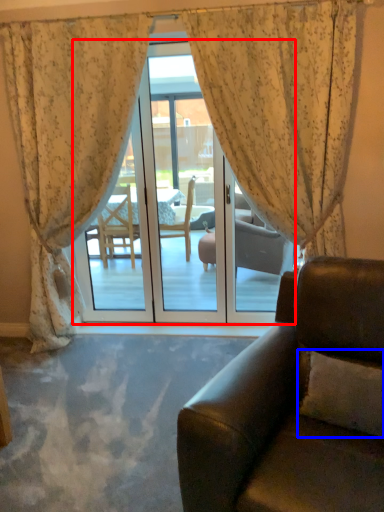
Question: Among these objects, which one is nearest to the camera, door (highlighted by a red box) or pillow (highlighted by a blue box)?

Choices:
 (A) door
 (B) pillow

Answer: (B)